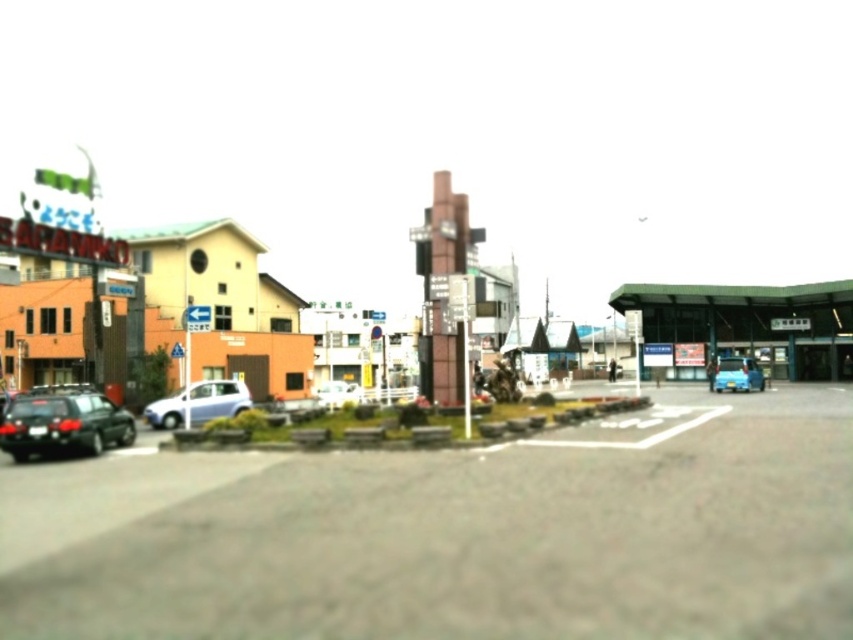
You are a delivery driver who needs to park your 5.5 meter long truck between the matte orange building at left and the black matte car at lower left. Can you fit your truck there?

The matte orange building at left and black matte car at lower left are 35.89 meters apart. Since your truck is only 5.5 meters long, there is more than enough space to park it between them.

You are a delivery driver approaching the street scene. You need to determine which object, the matte orange building at left or the black matte car at lower left, is bigger in the image. Based on the scene, which one would you say is larger?

The matte orange building at left is larger compared to the black matte car at lower left.

You are a delivery driver who needs to park your van between the black matte car at lower left and the blue glossy car at lower right. The van is 7 meters long. Is there enough space between them to park the van?

Result: The distance between the black matte car at lower left and the blue glossy car at lower right is 31.27 meters. Since the van is only 7 meters long, there is more than enough space to park the van between them.